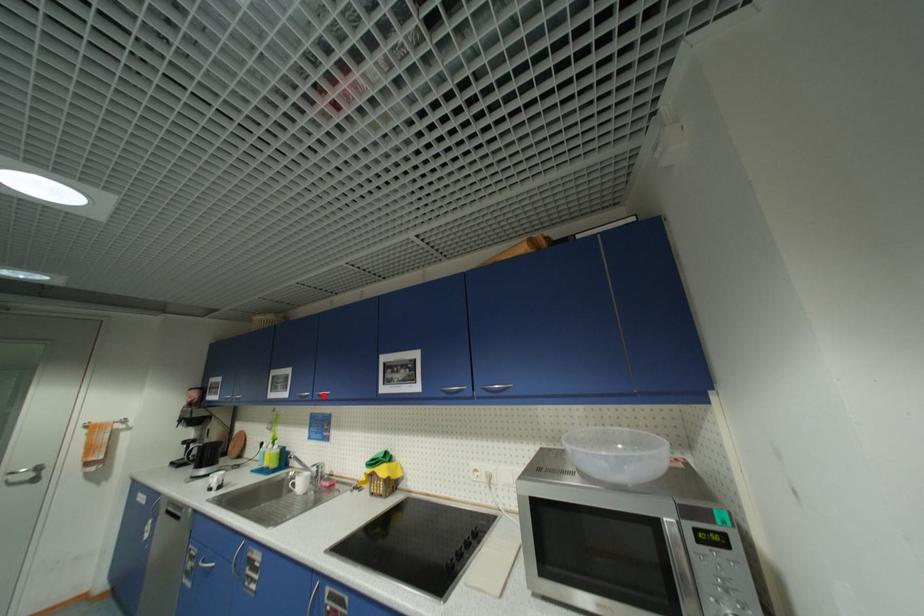
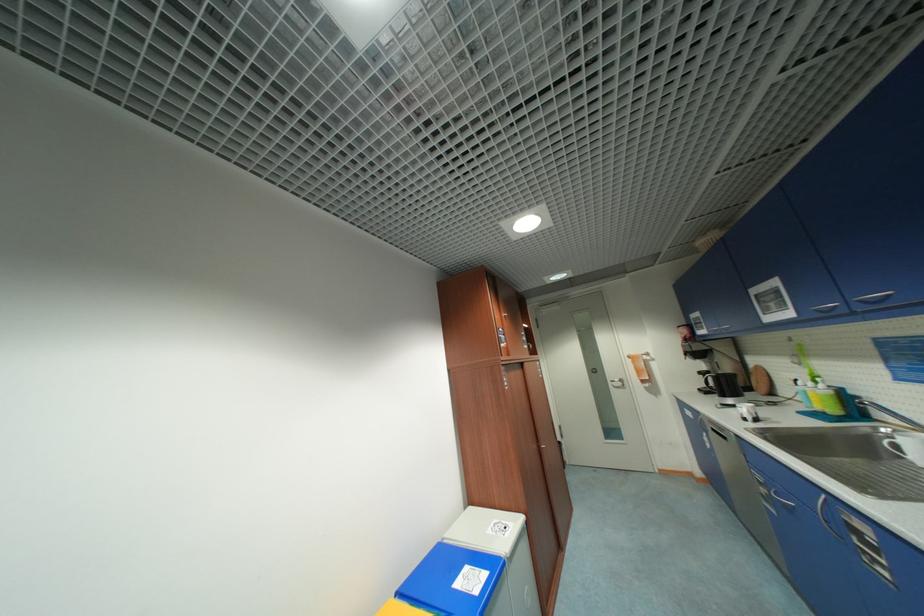
Question: I am providing you with two images of the same scene from different viewpoints. Given a red point in image1, look at the same physical point in image2. Is it:

Choices:
 (A) Closer to the viewpoint
 (B) Farther from the viewpoint

Answer: (A)